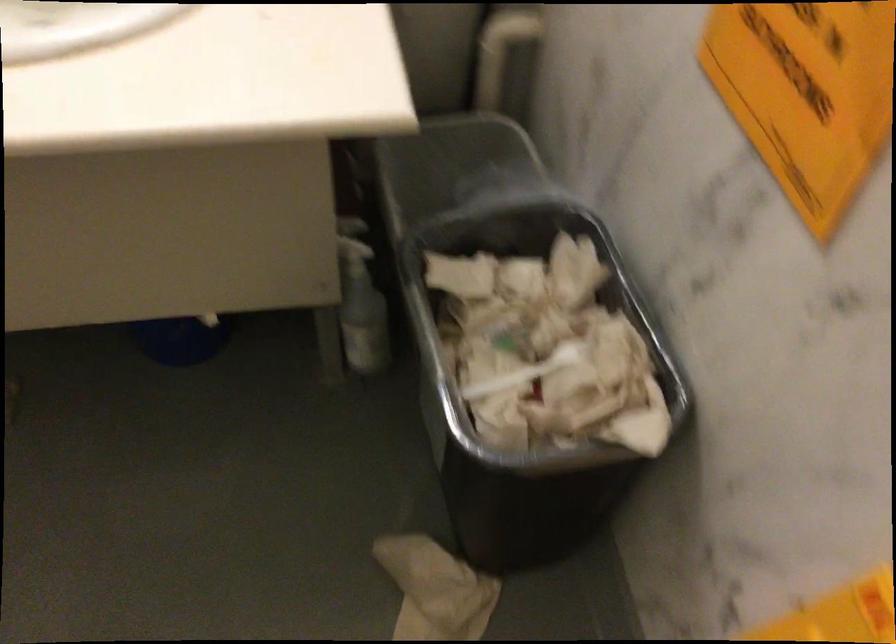
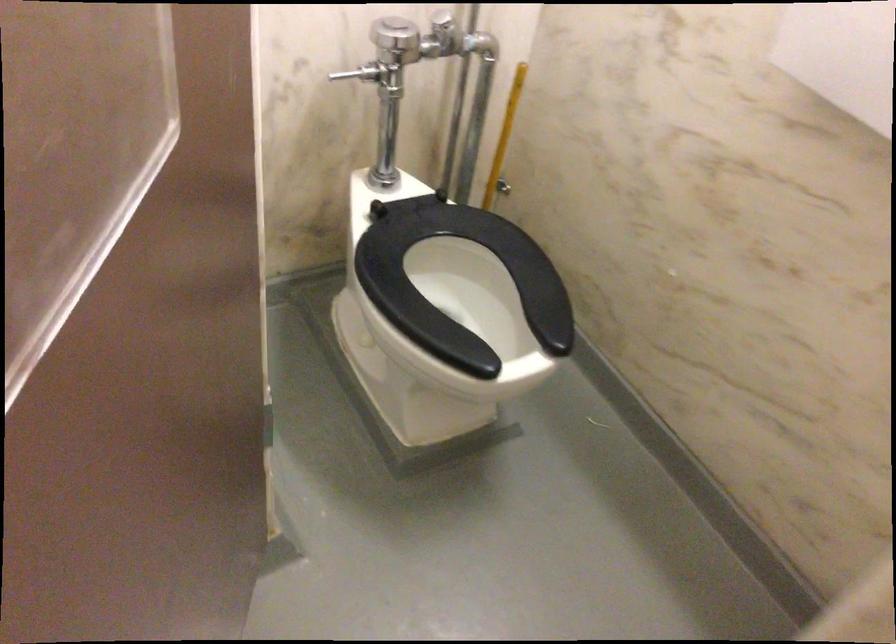
Question: The camera is either moving clockwise (left) or counter-clockwise (right) around the object. The first image is from the beginning of the video and the second image is from the end. Is the camera moving left or right when shooting the video?

Choices:
 (A) Left
 (B) Right

Answer: (B)